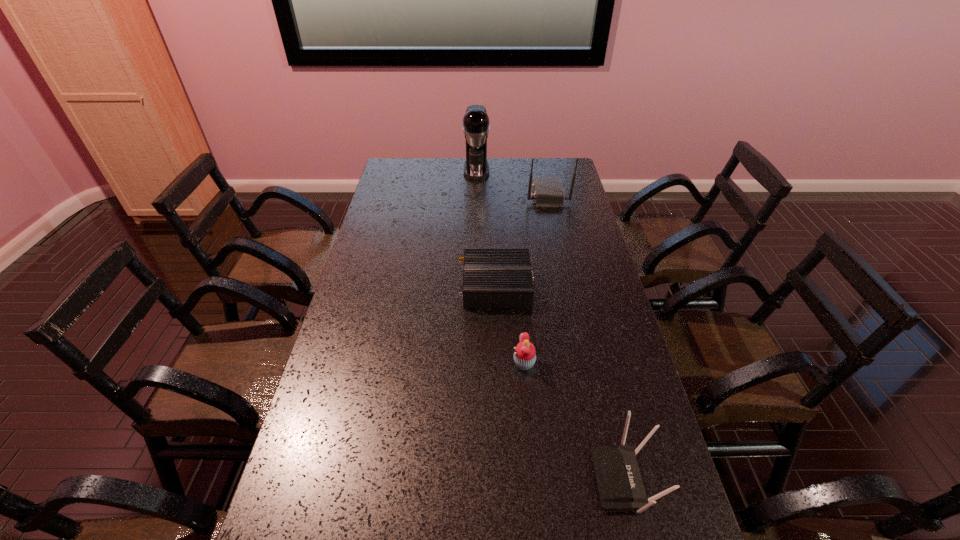
Where is `the tallest object`? This screenshot has height=540, width=960. the tallest object is located at coordinates (476, 127).

Where is `coffee maker`? coffee maker is located at coordinates (476, 127).

At what (x,y) coordinates should I click in order to perform the action: click on the second tallest object. Please return your answer as a coordinate pair (x, y). Looking at the image, I should click on click(x=548, y=192).

Image resolution: width=960 pixels, height=540 pixels. Find the location of `the farthest router`. the farthest router is located at coordinates (548, 192).

You are a GUI agent. You are given a task and a screenshot of the screen. Output one action in this format:
    pyautogui.click(x=<x>, y=<y>)
    Task: Click on the nearest router
    This screenshot has width=960, height=540.
    Given the screenshot: What is the action you would take?
    pyautogui.click(x=620, y=486)

Where is `the second tallest router`? The image size is (960, 540). the second tallest router is located at coordinates (620, 486).

Where is `the second nearest object`? the second nearest object is located at coordinates (524, 357).

I want to click on the fourth tallest object, so click(524, 357).

The height and width of the screenshot is (540, 960). What are the coordinates of `the shortest object` in the screenshot? It's located at (493, 278).

Find the location of a particular element. the third nearest object is located at coordinates (493, 278).